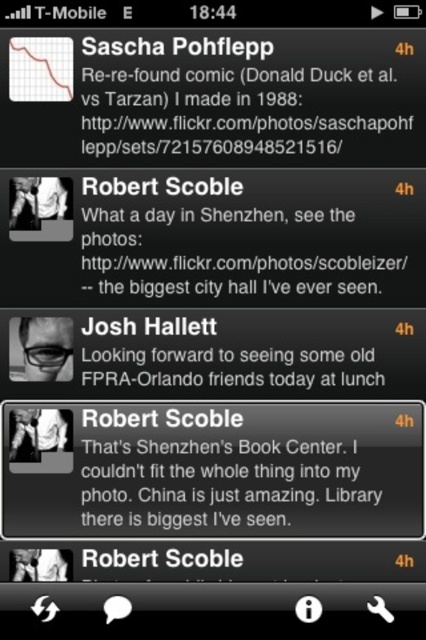
Is white shirt at center positioned at the back of white fabric shirt at center?

Yes.

Does point (28, 420) lie behind point (48, 563)?

Yes, point (28, 420) is behind point (48, 563).

Does point (25, 432) come behind point (60, 570)?

Yes.

Find the location of `white shirt at center`. white shirt at center is located at coordinates (37, 433).

Is black matte text message at center wider than white fabric shirt at center?

Yes.

Does black matte text message at center appear over white fabric shirt at center?

Indeed, black matte text message at center is positioned over white fabric shirt at center.

This screenshot has width=426, height=640. Describe the element at coordinates (233, 468) in the screenshot. I see `black matte text message at center` at that location.

The width and height of the screenshot is (426, 640). What are the coordinates of `black matte text message at center` in the screenshot? It's located at (233, 468).

Does black matte text message at upper center have a lesser height compared to white fabric shirt at center?

In fact, black matte text message at upper center may be taller than white fabric shirt at center.

Does black matte text message at upper center come behind white fabric shirt at center?

That is False.

Is point (305, 51) in front of point (54, 548)?

Yes.

I want to click on black matte text message at upper center, so click(x=253, y=99).